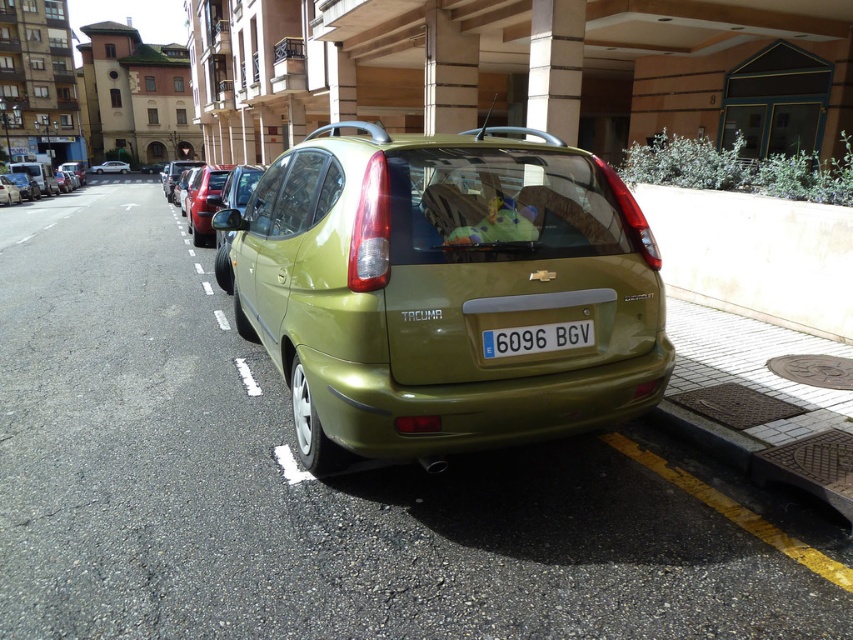
Does metallic silver sedan at center appear on the left side of metallic silver car at center?

Yes, metallic silver sedan at center is to the left of metallic silver car at center.

Which is above, metallic silver sedan at center or metallic silver car at center?

metallic silver sedan at center is higher up.

Which is behind, point (102, 163) or point (68, 163)?

Point (102, 163)

Where is `metallic silver sedan at center`? This screenshot has height=640, width=853. metallic silver sedan at center is located at coordinates (109, 168).

Can you confirm if olive metallic sedan at center is positioned to the left of white plastic license plate at center?

Correct, you'll find olive metallic sedan at center to the left of white plastic license plate at center.

Between olive metallic sedan at center and white plastic license plate at center, which one has less height?

Standing shorter between the two is white plastic license plate at center.

Who is more distant from viewer, (329, 304) or (488, 348)?

The point (329, 304) is more distant.

You are a GUI agent. You are given a task and a screenshot of the screen. Output one action in this format:
    pyautogui.click(x=<x>, y=<y>)
    Task: Click on the olive metallic sedan at center
    The width and height of the screenshot is (853, 640).
    Given the screenshot: What is the action you would take?
    coord(444,291)

In the scene shown: Is white plastic license plate at center to the right of matte green hatchback at center from the viewer's perspective?

Correct, you'll find white plastic license plate at center to the right of matte green hatchback at center.

Which is in front, point (560, 340) or point (9, 195)?

Point (560, 340) is more forward.

At what (x,y) coordinates should I click in order to perform the action: click on white plastic license plate at center. Please return your answer as a coordinate pair (x, y). This screenshot has height=640, width=853. Looking at the image, I should click on (537, 339).